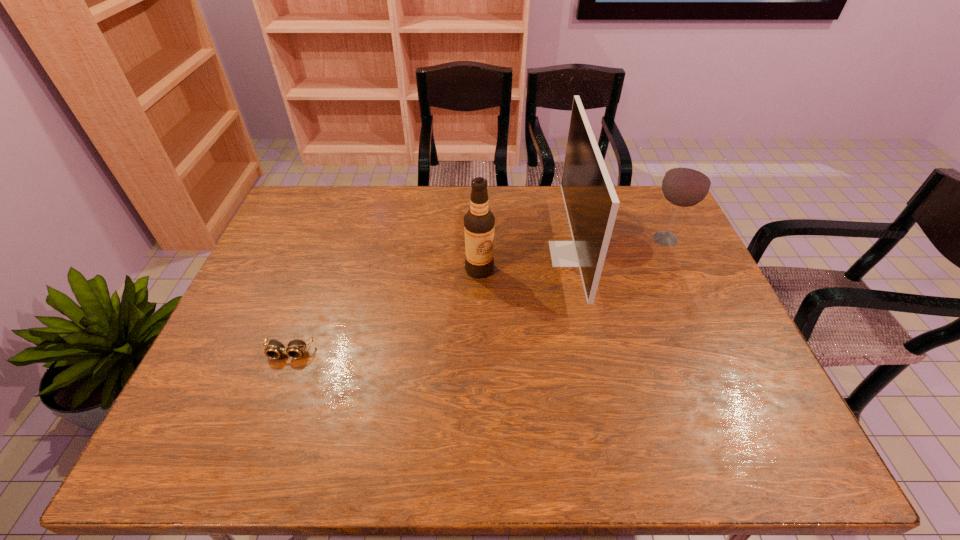
Identify the location of vacant area at the near edge of the desktop. (702, 459).

In the image, there is a desktop. At what (x,y) coordinates should I click in order to perform the action: click on vacant space at the left edge. Please return your answer as a coordinate pair (x, y). Looking at the image, I should click on (321, 232).

Find the location of `free space at the right edge of the desktop`. free space at the right edge of the desktop is located at coordinates (655, 272).

In the image, there is a desktop. Find the location of `vacant region at the far left corner`. vacant region at the far left corner is located at coordinates (297, 218).

Locate an element on the screen. The height and width of the screenshot is (540, 960). vacant space at the far right corner of the desktop is located at coordinates (647, 217).

Image resolution: width=960 pixels, height=540 pixels. I want to click on blank region between the nearer alcohol and the nearest object, so click(384, 311).

You are a GUI agent. You are given a task and a screenshot of the screen. Output one action in this format:
    pyautogui.click(x=<x>, y=<y>)
    Task: Click on the vacant space in between the second object from right to left and the rightmost object
    
    Given the screenshot: What is the action you would take?
    pyautogui.click(x=618, y=246)

Locate an element on the screen. vacant area that lies between the tallest object and the nearest object is located at coordinates (430, 303).

Find the location of a particular element. free point between the rightmost object and the third object from left to right is located at coordinates (618, 246).

What are the coordinates of `free space between the second object from left to right and the goggles` in the screenshot? It's located at (384, 311).